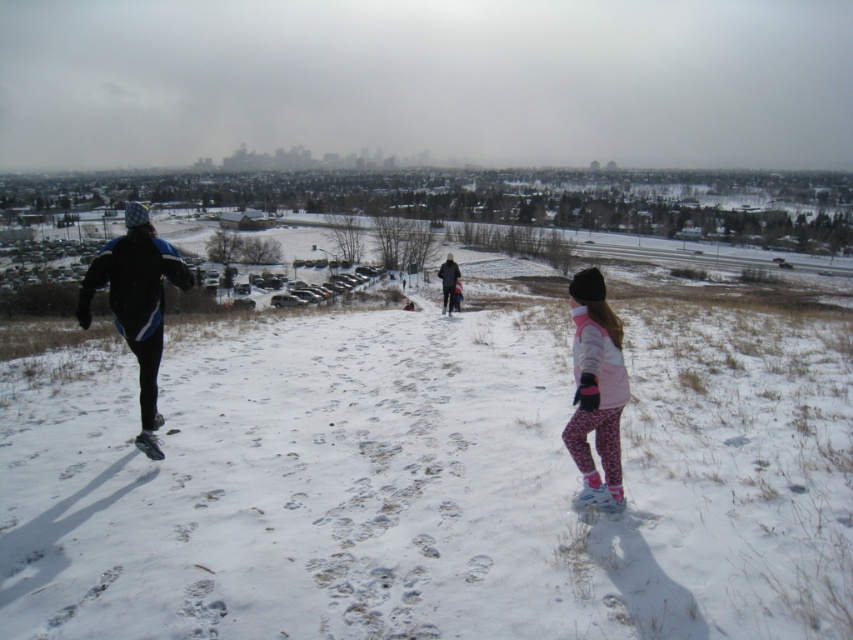
Question: Among these objects, which one is nearest to the camera?

Choices:
 (A) black matte running shoes at left
 (B) white fluffy snow at center
 (C) dark blue jacket at center

Answer: (B)

Question: Among these objects, which one is nearest to the camera?

Choices:
 (A) pink fleece jacket at center
 (B) dark blue jacket at center

Answer: (A)

Question: Which object is farther from the camera taking this photo?

Choices:
 (A) white fluffy snow at center
 (B) pink fleece jacket at center

Answer: (B)

Question: Is the position of black matte running shoes at left more distant than that of pink fleece jacket at center?

Choices:
 (A) no
 (B) yes

Answer: (B)

Question: Does black matte running shoes at left appear under pink fleece jacket at center?

Choices:
 (A) no
 (B) yes

Answer: (A)

Question: Observing the image, what is the correct spatial positioning of white fluffy snow at center in reference to pink fleece jacket at center?

Choices:
 (A) right
 (B) left

Answer: (B)